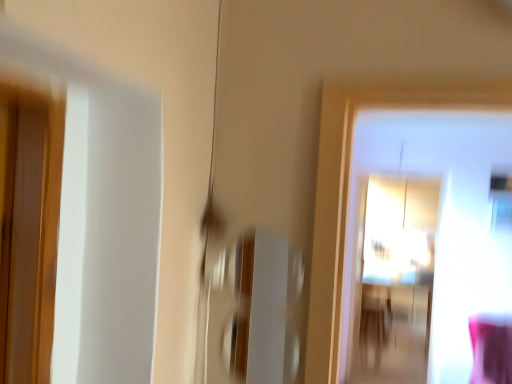
Question: Should I look upward or downward to see wooden table at center?

Choices:
 (A) up
 (B) down

Answer: (B)